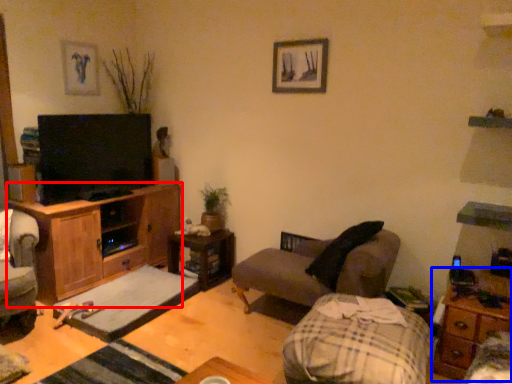
Question: Which object appears farthest to the camera in this image, cabinetry (highlighted by a red box) or nightstand (highlighted by a blue box)?

Choices:
 (A) cabinetry
 (B) nightstand

Answer: (A)